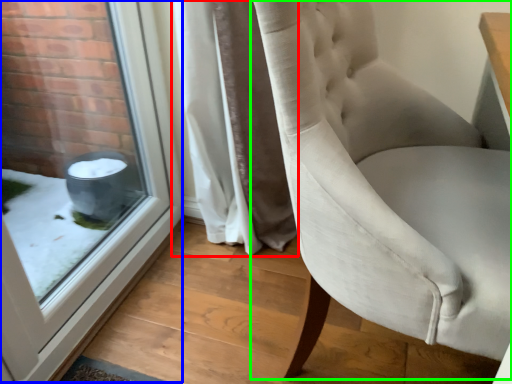
Question: Considering the real-world distances, which object is closest to curtain (highlighted by a red box)? window (highlighted by a blue box) or chair (highlighted by a green box).

Choices:
 (A) window
 (B) chair

Answer: (A)